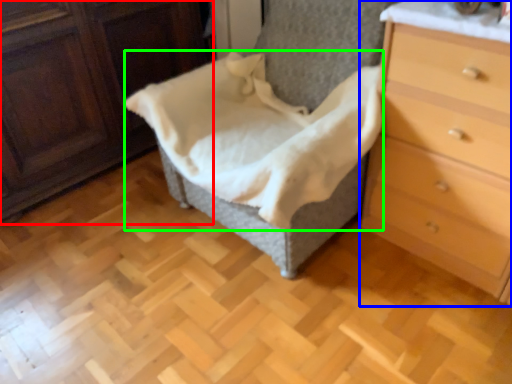
Question: Which object is positioned closest to furniture (highlighted by a red box)? Select from chest of drawers (highlighted by a blue box) and blanket (highlighted by a green box).

Choices:
 (A) chest of drawers
 (B) blanket

Answer: (B)